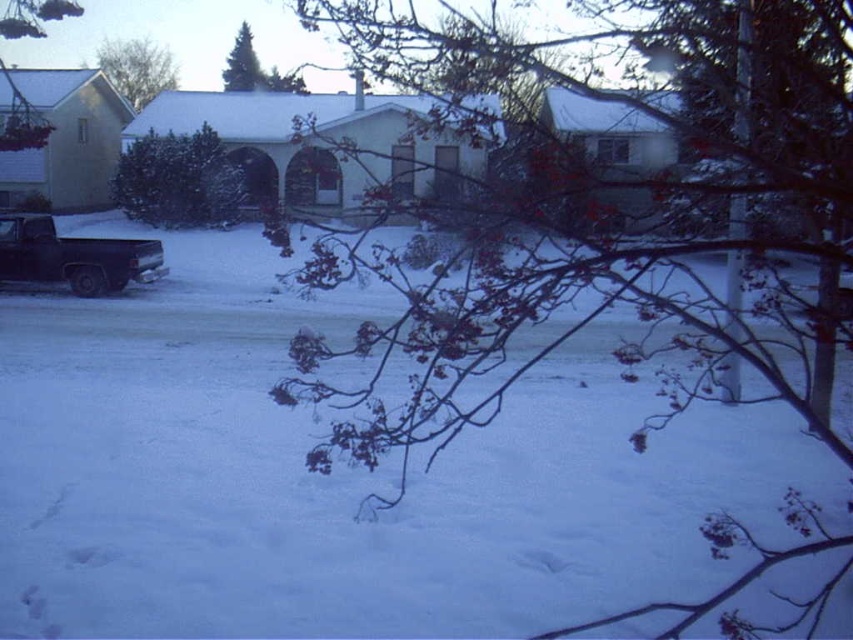
Question: Considering the relative positions of green textured bush at center and green matte evergreen tree at upper center in the image provided, where is green textured bush at center located with respect to green matte evergreen tree at upper center?

Choices:
 (A) left
 (B) right

Answer: (B)

Question: Which point is farther to the camera?

Choices:
 (A) green matte evergreen tree at upper center
 (B) matte black truck at left

Answer: (A)

Question: Can you confirm if bare branches at center is positioned to the right of smooth bark tree at upper left?

Choices:
 (A) yes
 (B) no

Answer: (A)

Question: Is green textured bush at center to the right of smooth bark tree at upper left from the viewer's perspective?

Choices:
 (A) yes
 (B) no

Answer: (A)

Question: Which object is farther from the camera taking this photo?

Choices:
 (A) green textured bush at center
 (B) bare branches at center
 (C) green matte evergreen tree at upper center
 (D) smooth bark tree at upper left

Answer: (C)

Question: Among these objects, which one is nearest to the camera?

Choices:
 (A) bare branches at upper left
 (B) green matte evergreen tree at upper center
 (C) green textured bush at center

Answer: (C)